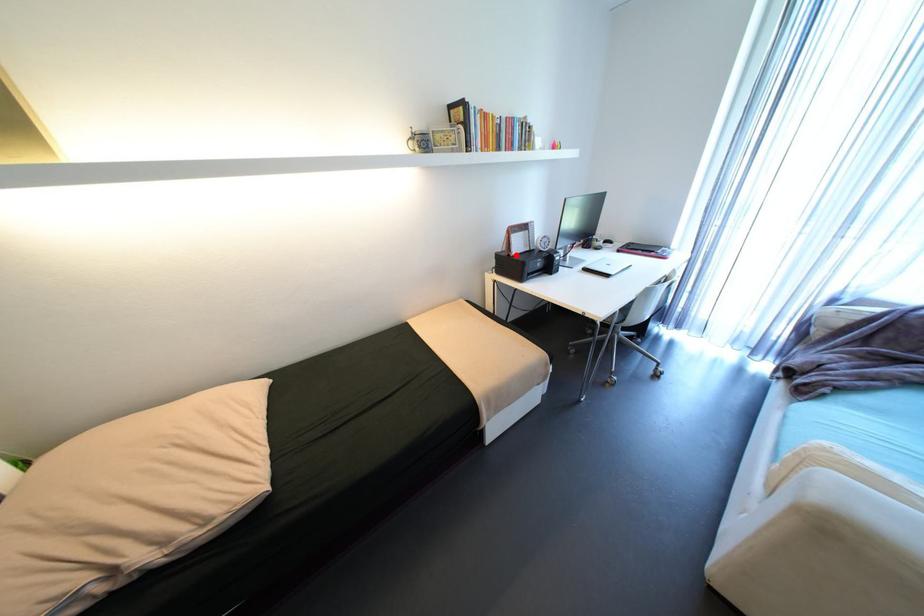
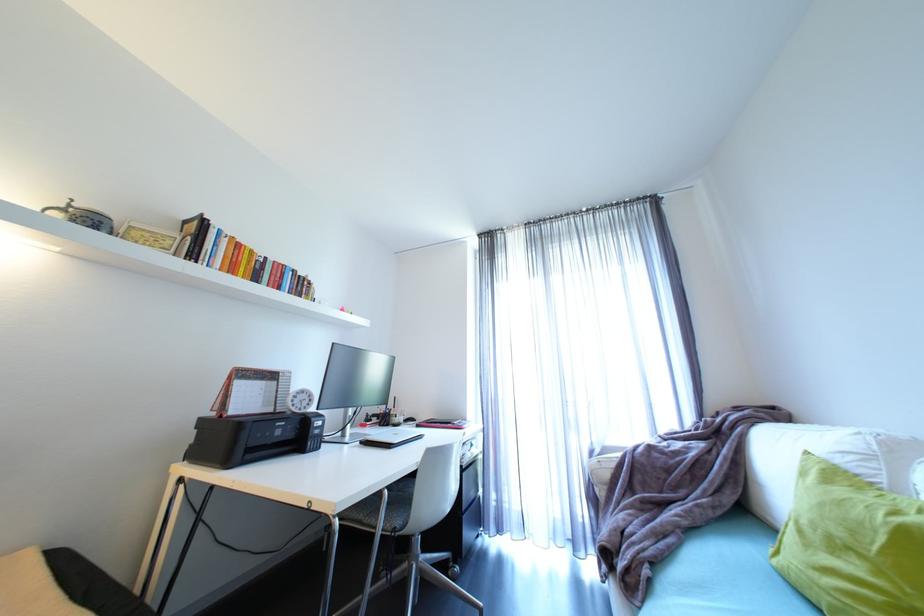
Where in the second image is the point corresponding to the highlighted location from the first image?

(228, 416)